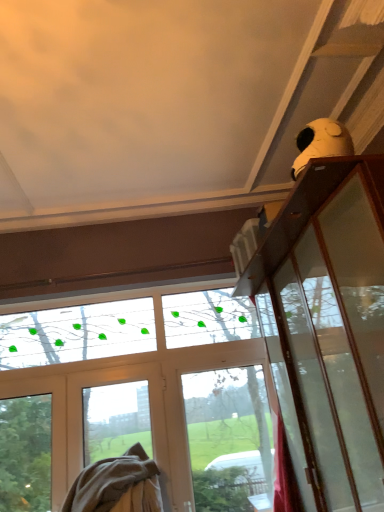
Question: Is beige cotton blanket at lower left shorter than white matte screen door at lower left?

Choices:
 (A) yes
 (B) no

Answer: (A)

Question: Is beige cotton blanket at lower left to the left of white matte screen door at lower left from the viewer's perspective?

Choices:
 (A) no
 (B) yes

Answer: (B)

Question: From the image's perspective, is beige cotton blanket at lower left on white matte screen door at lower left?

Choices:
 (A) yes
 (B) no

Answer: (B)

Question: Is beige cotton blanket at lower left smaller than white matte screen door at lower left?

Choices:
 (A) no
 (B) yes

Answer: (A)

Question: From a real-world perspective, is beige cotton blanket at lower left positioned under white matte screen door at lower left based on gravity?

Choices:
 (A) yes
 (B) no

Answer: (A)

Question: Considering the relative sizes of beige cotton blanket at lower left and white matte screen door at lower left in the image provided, is beige cotton blanket at lower left thinner than white matte screen door at lower left?

Choices:
 (A) no
 (B) yes

Answer: (A)

Question: Can you confirm if white matte screen door at lower left is shorter than beige cotton blanket at lower left?

Choices:
 (A) no
 (B) yes

Answer: (A)

Question: Are white matte screen door at lower left and beige cotton blanket at lower left beside each other?

Choices:
 (A) no
 (B) yes

Answer: (A)

Question: Can you confirm if white matte screen door at lower left is thinner than beige cotton blanket at lower left?

Choices:
 (A) no
 (B) yes

Answer: (B)

Question: Is white matte screen door at lower left not within beige cotton blanket at lower left?

Choices:
 (A) yes
 (B) no

Answer: (A)

Question: Is beige cotton blanket at lower left inside white matte screen door at lower left?

Choices:
 (A) yes
 (B) no

Answer: (B)

Question: Considering the relative positions of white matte screen door at lower left and beige cotton blanket at lower left in the image provided, is white matte screen door at lower left to the right of beige cotton blanket at lower left from the viewer's perspective?

Choices:
 (A) yes
 (B) no

Answer: (A)

Question: Considering their positions, is beige cotton blanket at lower left located in front of or behind white matte screen door at lower left?

Choices:
 (A) behind
 (B) front

Answer: (B)